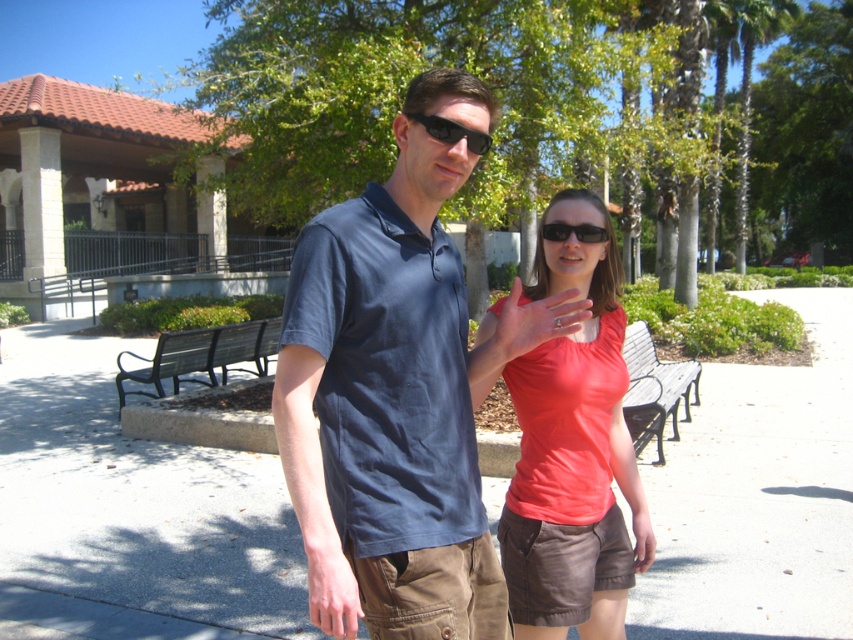
Is the position of black matte sunglasses at center more distant than that of black plastic sunglasses at center?

No.

Can you confirm if black matte sunglasses at center is positioned below black plastic sunglasses at center?

No, black matte sunglasses at center is not below black plastic sunglasses at center.

Between point (466, 145) and point (548, 236), which one is positioned behind?

The point (548, 236) is behind.

Where is `black matte sunglasses at center`? The image size is (853, 640). black matte sunglasses at center is located at coordinates (451, 131).

Which is behind, point (509, 307) or point (579, 234)?

Positioned behind is point (579, 234).

Is matte red shirt at center taller than black plastic sunglasses at center?

Yes.

Is point (541, 324) less distant than point (553, 234)?

Yes, it is.

Where is `matte red shirt at center`? The height and width of the screenshot is (640, 853). matte red shirt at center is located at coordinates (531, 321).

Is point (331, 616) positioned in front of point (486, 132)?

Yes, point (331, 616) is closer to viewer.

Is point (328, 556) behind point (438, 120)?

No, it is in front of (438, 120).

The height and width of the screenshot is (640, 853). In order to click on light skin tone hand at center in this screenshot , I will do `click(331, 588)`.